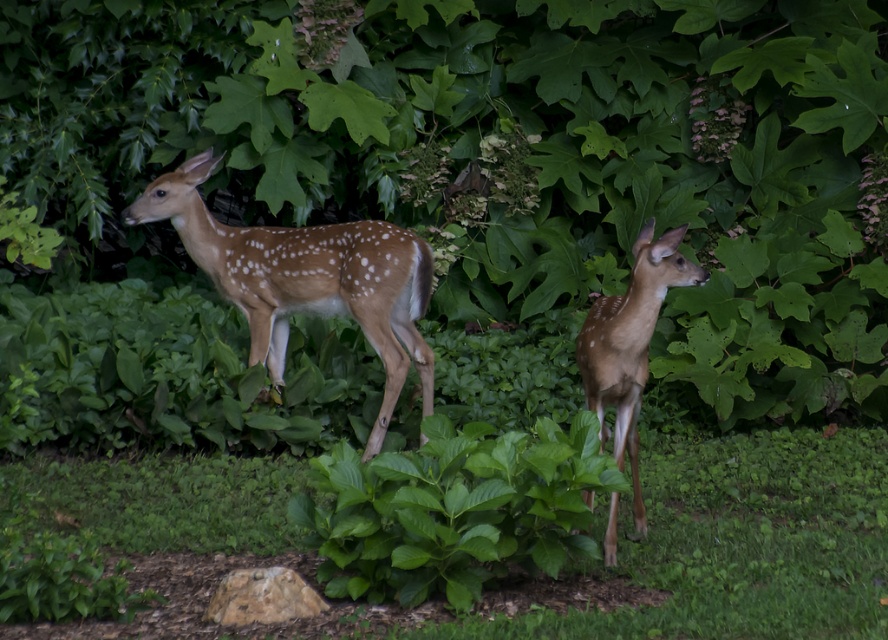
Question: Considering the real-world distances, which object is farthest from the green leafy tree at center?

Choices:
 (A) brown speckled fur at center
 (B) green leafy grass at center

Answer: (B)

Question: Which point is closer to the camera?

Choices:
 (A) brown matte/deer at center
 (B) green leafy grass at center
 (C) green leafy tree at center
 (D) brown speckled fur at center

Answer: (B)

Question: Is green leafy tree at center below green leafy grass at center?

Choices:
 (A) yes
 (B) no

Answer: (B)

Question: Is green leafy tree at center to the right of brown speckled fur at center from the viewer's perspective?

Choices:
 (A) no
 (B) yes

Answer: (A)

Question: Which point is closer to the camera taking this photo?

Choices:
 (A) (168, 205)
 (B) (868, 348)

Answer: (A)

Question: Is green leafy grass at center wider than brown speckled fur at center?

Choices:
 (A) no
 (B) yes

Answer: (A)